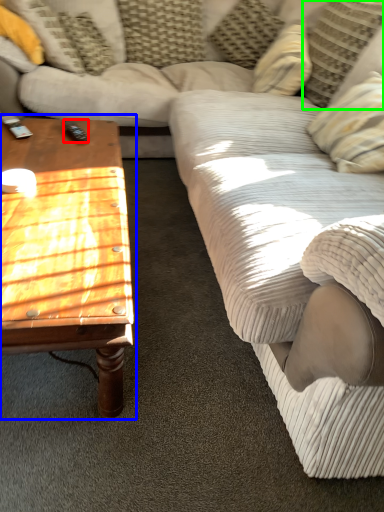
Question: Which is farther away from remote (highlighted by a red box)? coffee table (highlighted by a blue box) or pillow (highlighted by a green box)?

Choices:
 (A) coffee table
 (B) pillow

Answer: (B)